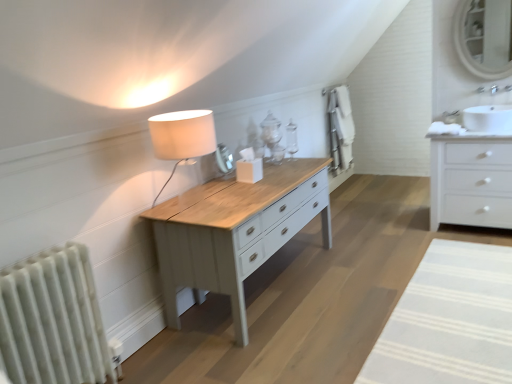
Describe the element at coordinates (53, 320) in the screenshot. I see `white textured radiator at left` at that location.

Locate an element on the screen. matte white wooden table at center is located at coordinates (219, 235).

This screenshot has height=384, width=512. What do you see at coordinates (450, 320) in the screenshot? I see `white striped rug at lower right` at bounding box center [450, 320].

Locate an element on the screen. matte white mirror at upper right is located at coordinates (483, 37).

Find the location of a particular element. The image size is (512, 384). white textured radiator at left is located at coordinates (53, 320).

Does white glossy sink at upper right appear on the left side of white striped rug at lower right?

No.

Is white glossy sink at upper right aimed at white striped rug at lower right?

No, white glossy sink at upper right is not turned towards white striped rug at lower right.

Would you say white glossy sink at upper right is inside or outside white striped rug at lower right?

white glossy sink at upper right is located beyond the bounds of white striped rug at lower right.

Is white glossy sink at upper right taller or shorter than white striped rug at lower right?

Considering their sizes, white glossy sink at upper right has more height than white striped rug at lower right.

From a real-world perspective, is matte white wood table lamp at center positioned above or below white striped rug at lower right?

In terms of real-world spatial position, matte white wood table lamp at center is above white striped rug at lower right.

Choose the correct answer: Is matte white wood table lamp at center inside white striped rug at lower right or outside it?

matte white wood table lamp at center cannot be found inside white striped rug at lower right.

How many degrees apart are the facing directions of matte white wood table lamp at center and white striped rug at lower right?

matte white wood table lamp at center and white striped rug at lower right are facing 93.5 degrees away from each other.

The height and width of the screenshot is (384, 512). What are the coordinates of `table lamp that is above the white striped rug at lower right (from a real-world perspective)` in the screenshot? It's located at (182, 137).

Is white glossy chest of drawers at right inside the boundaries of white striped rug at lower right, or outside?

white glossy chest of drawers at right is not inside white striped rug at lower right, it's outside.

Where is `plain that is on the left side of white glossy chest of drawers at right`? The image size is (512, 384). plain that is on the left side of white glossy chest of drawers at right is located at coordinates (450, 320).

How far apart are white glossy chest of drawers at right and white striped rug at lower right?

They are 98.26 centimeters apart.

Is white glossy chest of drawers at right in front of white striped rug at lower right?

No.

Is white glossy chest of drawers at right at the left side of matte white mirror at upper right?

Correct, you'll find white glossy chest of drawers at right to the left of matte white mirror at upper right.

The height and width of the screenshot is (384, 512). In order to click on mirror behind the white glossy chest of drawers at right in this screenshot , I will do `click(483, 37)`.

From a real-world perspective, is white glossy chest of drawers at right physically located above or below matte white mirror at upper right?

white glossy chest of drawers at right is below matte white mirror at upper right.

In terms of size, does white glossy chest of drawers at right appear bigger or smaller than matte white mirror at upper right?

Clearly, white glossy chest of drawers at right is larger in size than matte white mirror at upper right.

From a real-world perspective, does white glossy chest of drawers at right sit lower than matte white wooden table at center?

No.

Which object is more forward, white glossy chest of drawers at right or matte white wooden table at center?

matte white wooden table at center is in front.

Can you confirm if white glossy chest of drawers at right is shorter than matte white wooden table at center?

In fact, white glossy chest of drawers at right may be taller than matte white wooden table at center.

From the image's perspective, who appears lower, white textured radiator at left or matte white mirror at upper right?

white textured radiator at left is shown below in the image.

From a real-world perspective, which is physically below, white textured radiator at left or matte white mirror at upper right?

white textured radiator at left is physically lower.

Does white textured radiator at left have a larger size compared to matte white mirror at upper right?

Yes.

Where is `sink behind the white striped rug at lower right`? This screenshot has width=512, height=384. sink behind the white striped rug at lower right is located at coordinates click(488, 118).

Is white glossy sink at upper right inside white striped rug at lower right?

No, white striped rug at lower right does not contain white glossy sink at upper right.

From the image's perspective, between white striped rug at lower right and white glossy sink at upper right, which one is located above?

white glossy sink at upper right is shown above in the image.

Image resolution: width=512 pixels, height=384 pixels. Find the location of `sink that appears behind the white striped rug at lower right`. sink that appears behind the white striped rug at lower right is located at coordinates (488, 118).

Image resolution: width=512 pixels, height=384 pixels. Find the location of `plain that is under the matte white wood table lamp at center (from a real-world perspective)`. plain that is under the matte white wood table lamp at center (from a real-world perspective) is located at coordinates (450, 320).

Considering their positions, is white glossy chest of drawers at right positioned further to white striped rug at lower right than matte white wood table lamp at center?

matte white wood table lamp at center lies further to white striped rug at lower right than the other object.

Considering their positions, is white striped rug at lower right positioned closer to matte white wooden table at center than white textured radiator at left?

white textured radiator at left.

Estimate the real-world distances between objects in this image. Which object is further from white glossy sink at upper right, matte white wooden table at center or white textured radiator at left?

white textured radiator at left.

Based on the photo, estimate the real-world distances between objects in this image. Which object is closer to matte white wood table lamp at center, matte white wooden table at center or white striped rug at lower right?

Based on the image, matte white wooden table at center appears to be nearer to matte white wood table lamp at center.

When comparing their distances from white glossy chest of drawers at right, does matte white wooden table at center or matte white wood table lamp at center seem further?

matte white wood table lamp at center.

From the image, which object appears to be nearer to matte white mirror at upper right, matte white wood table lamp at center or white glossy chest of drawers at right?

white glossy chest of drawers at right.

When comparing their distances from matte white mirror at upper right, does white glossy sink at upper right or white textured radiator at left seem closer?

white glossy sink at upper right is closer to matte white mirror at upper right.

Which object lies further to the anchor point matte white wooden table at center, white striped rug at lower right or matte white wood table lamp at center?

white striped rug at lower right lies further to matte white wooden table at center than the other object.

Where is `plain between matte white wooden table at center and white glossy chest of drawers at right from left to right`? Image resolution: width=512 pixels, height=384 pixels. plain between matte white wooden table at center and white glossy chest of drawers at right from left to right is located at coordinates (450, 320).

Where is `plain located between matte white wooden table at center and white glossy sink at upper right in the left-right direction`? The height and width of the screenshot is (384, 512). plain located between matte white wooden table at center and white glossy sink at upper right in the left-right direction is located at coordinates (450, 320).

I want to click on table lamp between white textured radiator at left and white glossy chest of drawers at right in the horizontal direction, so click(x=182, y=137).

Where is `table between matte white wood table lamp at center and matte white mirror at upper right from left to right`? table between matte white wood table lamp at center and matte white mirror at upper right from left to right is located at coordinates 219,235.